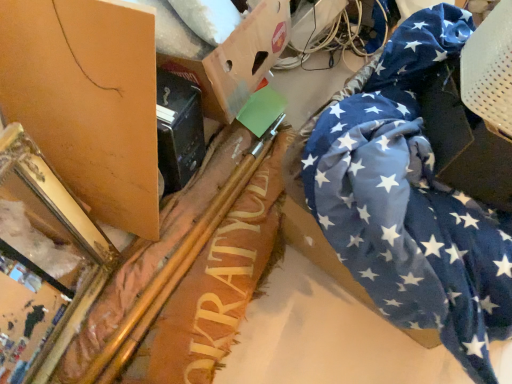
Question: Is blue star-patterned fabric at right oriented away from blue fabric at right, marked as the 3th cardboard box in a left-to-right arrangement?

Choices:
 (A) no
 (B) yes

Answer: (A)

Question: Does blue star-patterned fabric at right have a smaller size compared to blue fabric at right, marked as the 3th cardboard box in a left-to-right arrangement?

Choices:
 (A) no
 (B) yes

Answer: (A)

Question: Can you confirm if blue star-patterned fabric at right is shorter than blue fabric at right, positioned as the first cardboard box in right-to-left order?

Choices:
 (A) no
 (B) yes

Answer: (A)

Question: Can you confirm if blue star-patterned fabric at right is wider than blue fabric at right, positioned as the first cardboard box in right-to-left order?

Choices:
 (A) no
 (B) yes

Answer: (B)

Question: Is blue star-patterned fabric at right closer to the viewer compared to blue fabric at right, positioned as the first cardboard box in right-to-left order?

Choices:
 (A) yes
 (B) no

Answer: (A)

Question: Can you confirm if blue star-patterned fabric at right is positioned to the right of blue fabric at right, positioned as the first cardboard box in right-to-left order?

Choices:
 (A) yes
 (B) no

Answer: (B)

Question: From the image's perspective, is blue star-patterned fabric at right below matte brown cardboard at upper left, the 1th cardboard box when ordered from left to right?

Choices:
 (A) no
 (B) yes

Answer: (B)

Question: Can you confirm if blue star-patterned fabric at right is shorter than matte brown cardboard at upper left, the 1th cardboard box when ordered from left to right?

Choices:
 (A) yes
 (B) no

Answer: (A)

Question: Does blue star-patterned fabric at right have a lesser width compared to matte brown cardboard at upper left, the 1th cardboard box when ordered from left to right?

Choices:
 (A) no
 (B) yes

Answer: (A)

Question: Is blue star-patterned fabric at right positioned far away from matte brown cardboard at upper left, which appears as the third cardboard box when viewed from the right?

Choices:
 (A) yes
 (B) no

Answer: (B)

Question: From the image's perspective, does blue star-patterned fabric at right appear higher than matte brown cardboard at upper left, which appears as the third cardboard box when viewed from the right?

Choices:
 (A) yes
 (B) no

Answer: (B)

Question: Is blue star-patterned fabric at right taller than matte brown cardboard at upper left, the 1th cardboard box when ordered from left to right?

Choices:
 (A) yes
 (B) no

Answer: (B)

Question: Is gold metallic mirror at left far from green plastic wire at upper center?

Choices:
 (A) no
 (B) yes

Answer: (B)